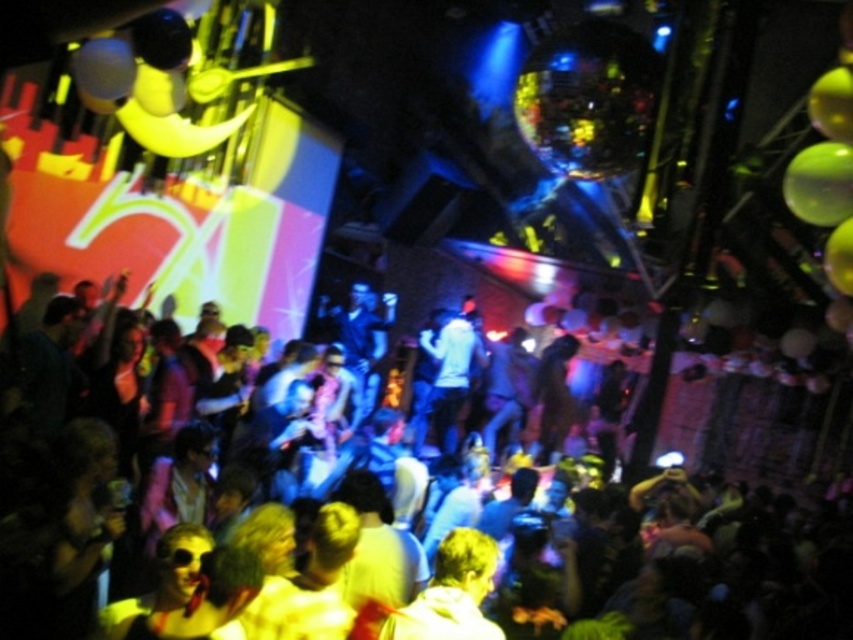
Question: Which point appears closest to the camera in this image?

Choices:
 (A) (764, 592)
 (B) (848, 186)

Answer: (B)

Question: Is shiny plastic balloons at center thinner than green rubber balloon at upper right?

Choices:
 (A) no
 (B) yes

Answer: (A)

Question: Is shiny plastic balloons at center to the right of green rubber balloon at upper right from the viewer's perspective?

Choices:
 (A) no
 (B) yes

Answer: (B)

Question: Which point is closer to the camera taking this photo?

Choices:
 (A) (459, 403)
 (B) (671, 468)
 (C) (798, 211)

Answer: (C)

Question: Does shiny plastic balloons at center appear on the right side of green rubber balloon at upper right?

Choices:
 (A) yes
 (B) no

Answer: (A)

Question: Which is farther from the green rubber balloon at upper right?

Choices:
 (A) white matte shirt at center
 (B) shiny plastic balloons at center

Answer: (A)